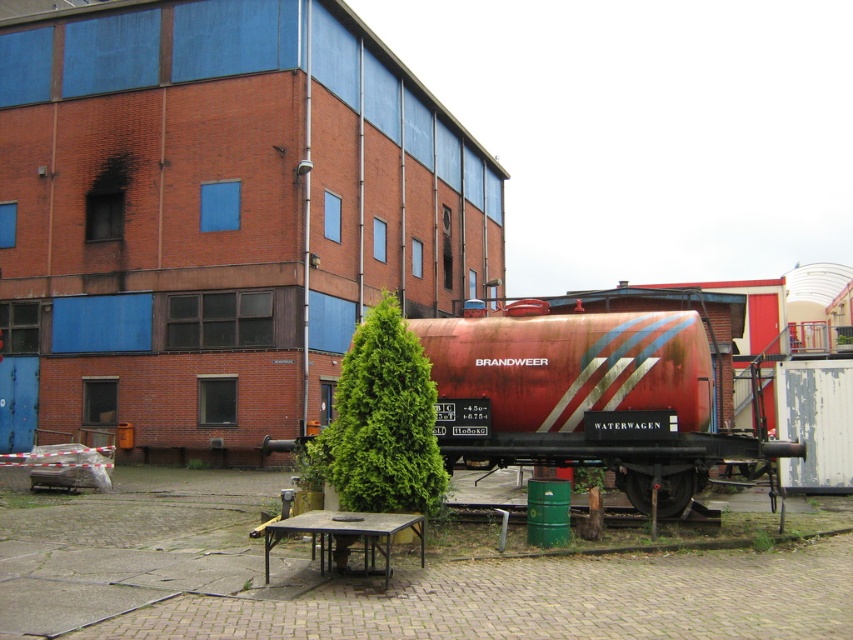
Does rusty metal tank at center appear on the left side of wooden picnic table at lower center?

No, rusty metal tank at center is not to the left of wooden picnic table at lower center.

Between rusty metal tank at center and wooden picnic table at lower center, which one is positioned lower?

wooden picnic table at lower center is lower down.

Is point (492, 349) behind point (412, 525)?

Yes, it is behind point (412, 525).

You are a GUI agent. You are given a task and a screenshot of the screen. Output one action in this format:
    pyautogui.click(x=<x>, y=<y>)
    Task: Click on the rusty metal tank at center
    The height and width of the screenshot is (640, 853).
    Given the screenshot: What is the action you would take?
    pyautogui.click(x=585, y=397)